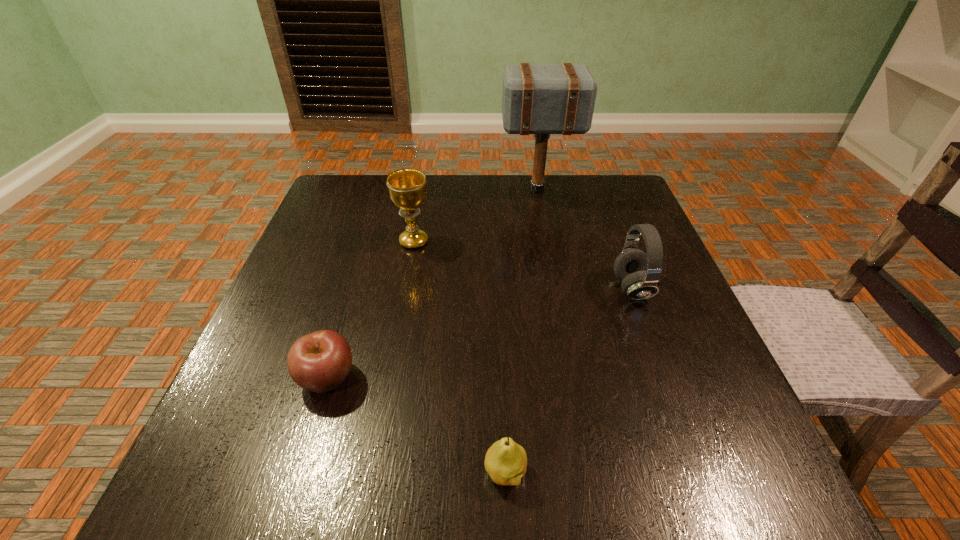
Locate an element on the screen. object that is positioned at the left edge is located at coordinates (320, 361).

The height and width of the screenshot is (540, 960). Find the location of `mallet located in the right edge section of the desktop`. mallet located in the right edge section of the desktop is located at coordinates (536, 99).

Identify the location of headset positioned at the right edge. (639, 272).

I want to click on object positioned at the far right corner, so click(x=536, y=99).

Locate an element on the screen. Image resolution: width=960 pixels, height=540 pixels. vacant region at the far edge of the desktop is located at coordinates (468, 195).

Identify the location of vacant space at the near edge. The width and height of the screenshot is (960, 540). (341, 480).

In the image, there is a desktop. Identify the location of vacant space at the left edge. The height and width of the screenshot is (540, 960). (323, 313).

You are a GUI agent. You are given a task and a screenshot of the screen. Output one action in this format:
    pyautogui.click(x=<x>, y=<y>)
    Task: Click on the vacant area at the right edge of the desktop
    
    Given the screenshot: What is the action you would take?
    pyautogui.click(x=649, y=339)

What are the coordinates of `vacant space at the far left corner of the desktop` in the screenshot? It's located at [x=343, y=192].

Image resolution: width=960 pixels, height=540 pixels. In order to click on vacant space at the near left corner in this screenshot , I will do `click(206, 465)`.